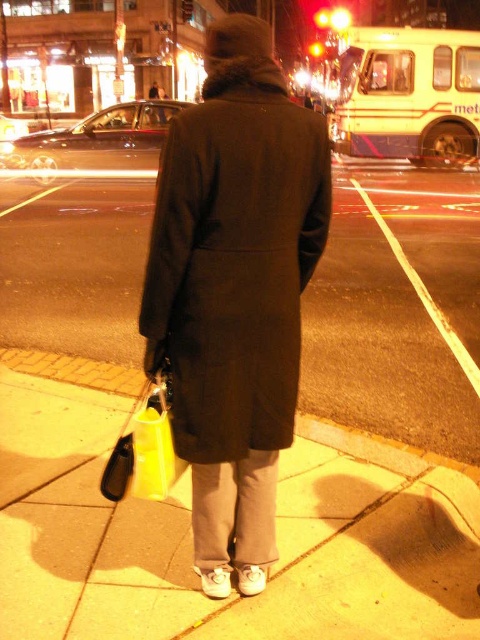
You are a delivery drone flying over the nighttime urban scene. Your GPS coordinates are set to land at point [190,536]. According to the scene description, where should you land?

The point [190,536] is on the gray concrete sidewalk at center, so you should land there.

You are a delivery drone flying over the city. You need to land on the gray concrete sidewalk at center to deliver a package. However, there is a dark wool coat at center in your landing path. Can you safely land on the sidewalk without hitting the coat?

The gray concrete sidewalk at center is not as tall as dark wool coat at center, meaning the sidewalk is shorter in height. Since the sidewalk itself is lower than the coat, the drone cannot land there safely as the coat is blocking the area.